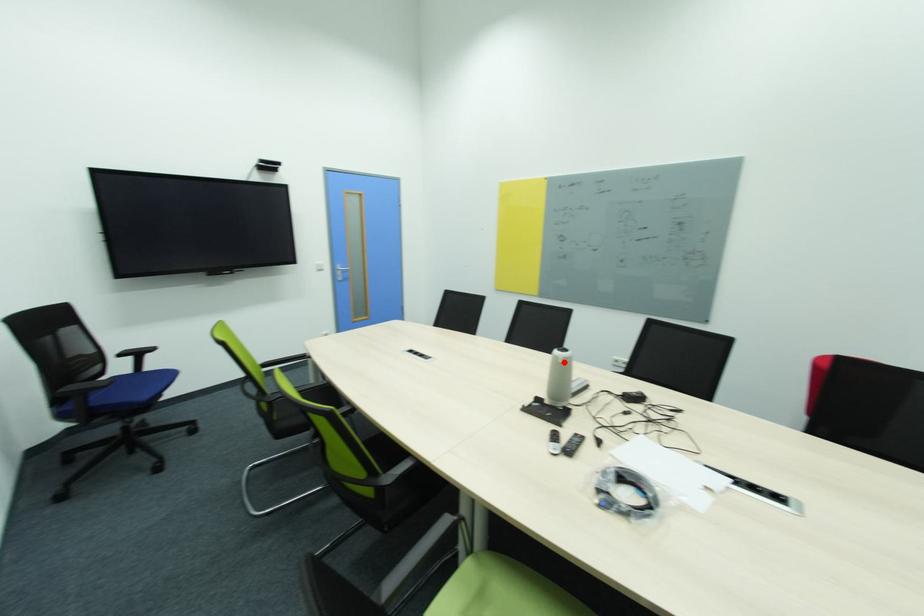
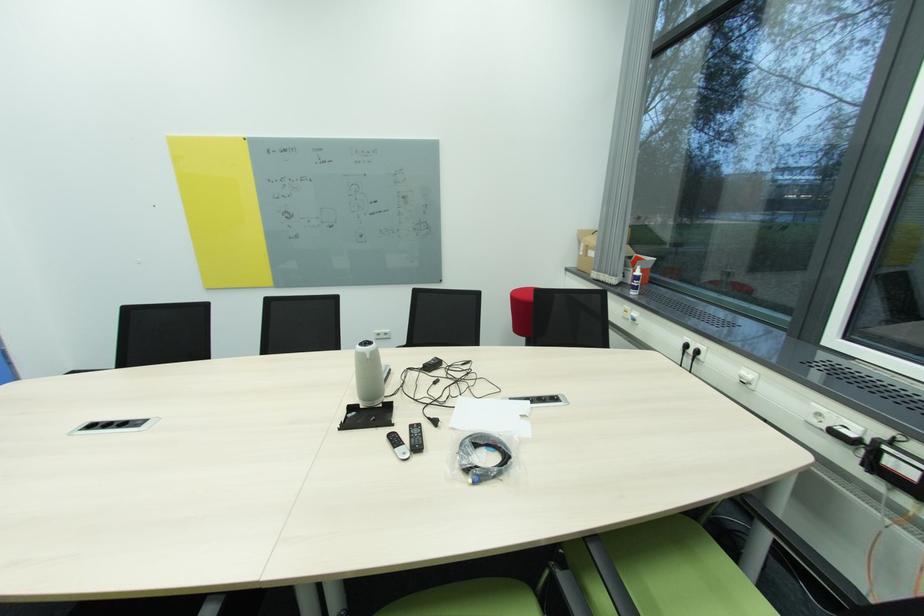
Locate, in the second image, the point that corresponds to the highlighted location in the first image.

(372, 358)